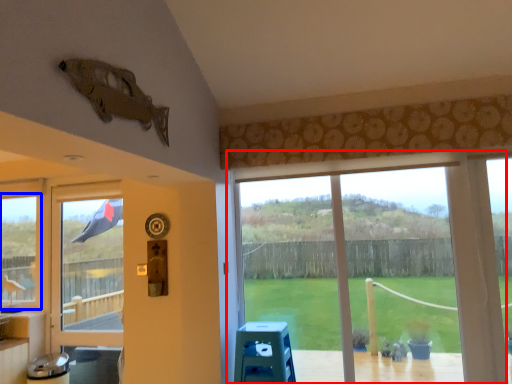
Question: Which of the following is the closest to the observer, window (highlighted by a red box) or window (highlighted by a blue box)?

Choices:
 (A) window
 (B) window

Answer: (A)